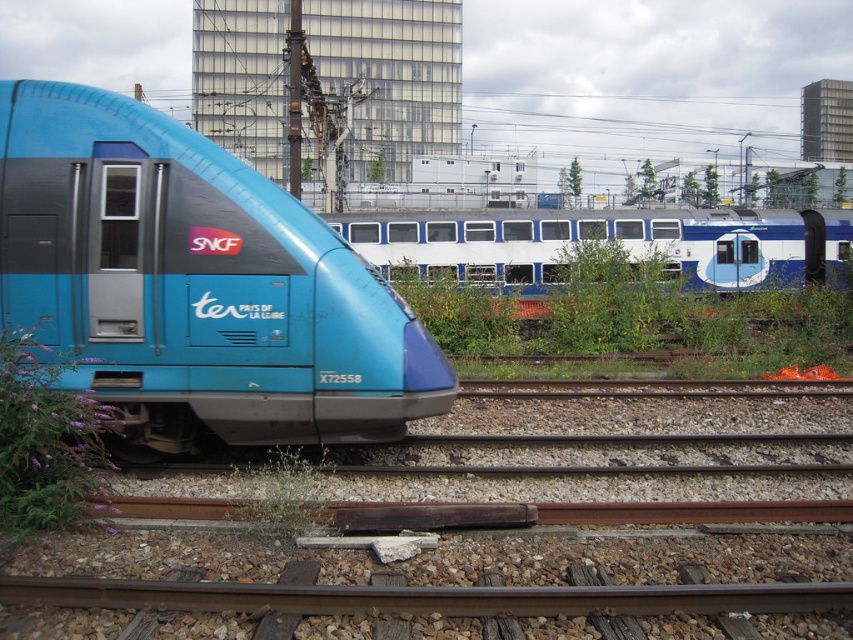
Question: Estimate the real-world distances between objects in this image. Which object is farther from the white glossy passenger train at center?

Choices:
 (A) matte blue train at left
 (B) purple soft plant at lower left

Answer: (B)

Question: Estimate the real-world distances between objects in this image. Which object is farther from the white glossy passenger train at center?

Choices:
 (A) matte blue train at left
 (B) purple soft plant at lower left

Answer: (B)

Question: Is matte blue train at left behind purple soft plant at lower left?

Choices:
 (A) no
 (B) yes

Answer: (B)

Question: Where is matte blue train at left located in relation to white glossy passenger train at center in the image?

Choices:
 (A) right
 (B) left

Answer: (B)

Question: Which point is closer to the camera?

Choices:
 (A) white glossy passenger train at center
 (B) purple soft plant at lower left
 (C) matte blue train at left

Answer: (B)

Question: From the image, what is the correct spatial relationship of white glossy passenger train at center in relation to purple soft plant at lower left?

Choices:
 (A) above
 (B) below

Answer: (A)